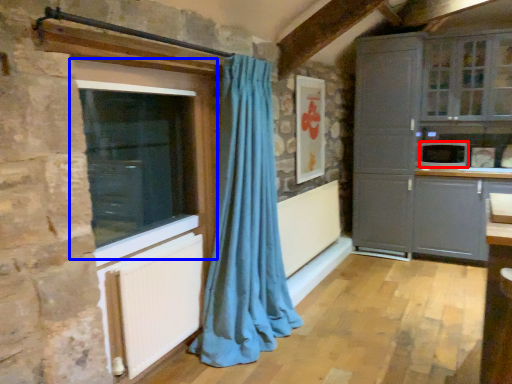
Question: Which of the following is the closest to the observer, appliance (highlighted by a red box) or window (highlighted by a blue box)?

Choices:
 (A) appliance
 (B) window

Answer: (B)